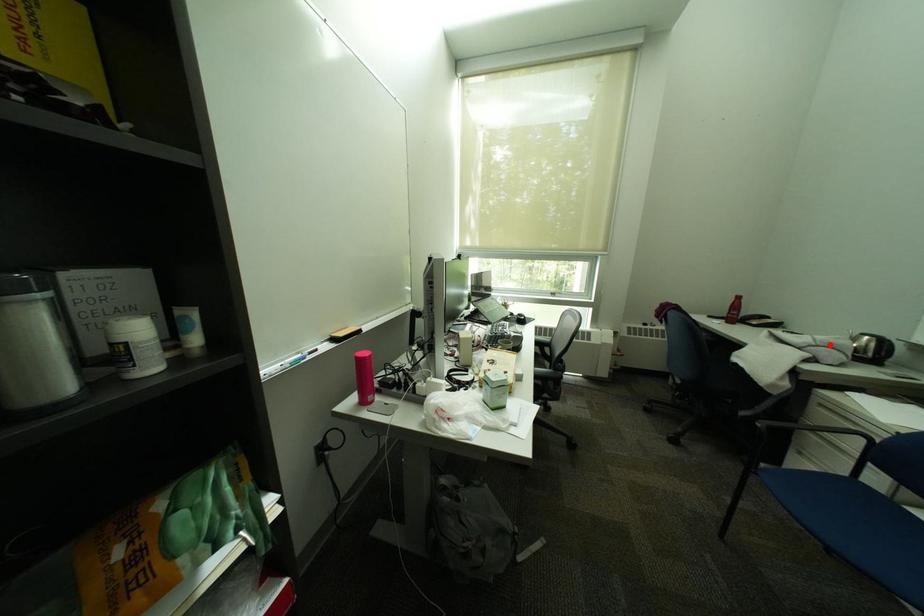
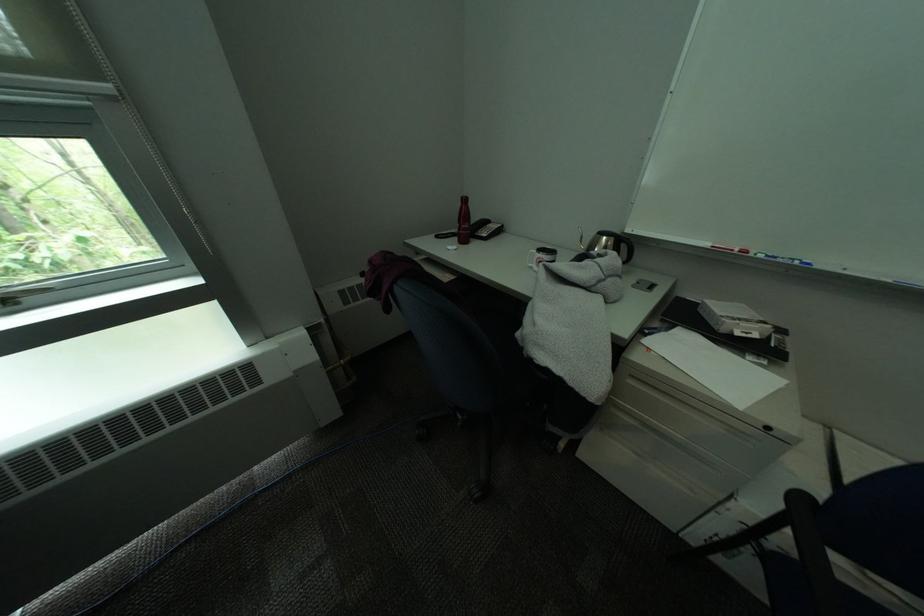
Find the pixel in the second image that matches the highlighted location in the first image.

(615, 274)